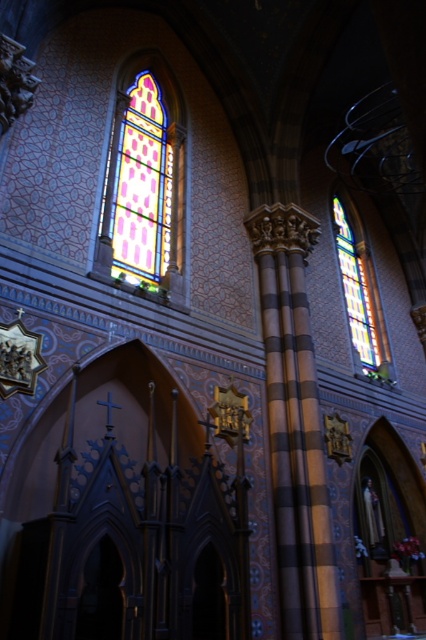
Question: Can you confirm if stained glass window at upper left is positioned above stained glass window at upper right?

Choices:
 (A) no
 (B) yes

Answer: (B)

Question: Is stained glass window at upper left above stained glass window at upper right?

Choices:
 (A) yes
 (B) no

Answer: (A)

Question: Is stained glass window at upper left to the left of stained glass window at upper right from the viewer's perspective?

Choices:
 (A) no
 (B) yes

Answer: (B)

Question: Which object is farther from the camera taking this photo?

Choices:
 (A) stained glass window at upper right
 (B) stained glass window at upper left

Answer: (A)

Question: Which point is closer to the camera taking this photo?

Choices:
 (A) (141, 80)
 (B) (342, 264)

Answer: (A)